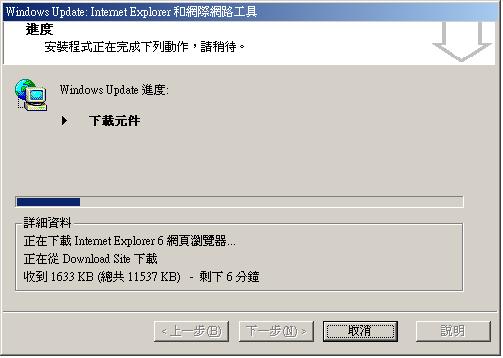
Locate an element on the screen. This screenshot has height=358, width=503. dark blue bar is located at coordinates (40, 200).